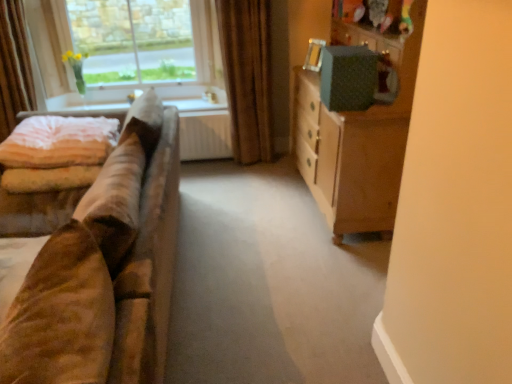
Question: Can you confirm if light pink velvety quilt at left is bigger than clear glass window at upper left?

Choices:
 (A) no
 (B) yes

Answer: (A)

Question: Considering the relative sizes of light pink velvety quilt at left and clear glass window at upper left in the image provided, is light pink velvety quilt at left smaller than clear glass window at upper left?

Choices:
 (A) no
 (B) yes

Answer: (B)

Question: From the image's perspective, is light pink velvety quilt at left located beneath clear glass window at upper left?

Choices:
 (A) yes
 (B) no

Answer: (A)

Question: Is light pink velvety quilt at left to the left of clear glass window at upper left from the viewer's perspective?

Choices:
 (A) yes
 (B) no

Answer: (A)

Question: Would you say clear glass window at upper left is part of light pink velvety quilt at left's contents?

Choices:
 (A) yes
 (B) no

Answer: (B)

Question: Would you say clear glass window at upper left is to the left or to the right of velvet curtain at left, the second curtain from the right, in the picture?

Choices:
 (A) right
 (B) left

Answer: (A)

Question: From a real-world perspective, is clear glass window at upper left positioned above or below velvet curtain at left, positioned as the first curtain in left-to-right order?

Choices:
 (A) below
 (B) above

Answer: (B)

Question: Relative to velvet curtain at left, the second curtain from the right, is clear glass window at upper left in front or behind?

Choices:
 (A) front
 (B) behind

Answer: (B)

Question: Considering the positions of clear glass window at upper left and velvet curtain at left, the second curtain from the right, in the image, is clear glass window at upper left bigger or smaller than velvet curtain at left, the second curtain from the right,?

Choices:
 (A) small
 (B) big

Answer: (B)

Question: Looking at their shapes, would you say brown velvet curtain at upper center, which ranks as the 1th curtain in right-to-left order, is wider or thinner than velvet curtain at left, the second curtain from the right?

Choices:
 (A) wide
 (B) thin

Answer: (A)

Question: Would you say brown velvet curtain at upper center, which ranks as the 1th curtain in right-to-left order, is to the left or to the right of velvet curtain at left, positioned as the first curtain in left-to-right order, in the picture?

Choices:
 (A) right
 (B) left

Answer: (A)

Question: Based on their sizes in the image, would you say brown velvet curtain at upper center, which ranks as the 1th curtain in right-to-left order, is bigger or smaller than velvet curtain at left, the second curtain from the right?

Choices:
 (A) small
 (B) big

Answer: (B)

Question: From a real-world perspective, is brown velvet curtain at upper center, which ranks as the 1th curtain in right-to-left order, above or below velvet curtain at left, positioned as the first curtain in left-to-right order?

Choices:
 (A) above
 (B) below

Answer: (B)

Question: Considering the positions of velvet curtain at left, the second curtain from the right, and green textured cabinet at right in the image, is velvet curtain at left, the second curtain from the right, bigger or smaller than green textured cabinet at right?

Choices:
 (A) big
 (B) small

Answer: (B)

Question: In the image, is velvet curtain at left, positioned as the first curtain in left-to-right order, on the left side or the right side of green textured cabinet at right?

Choices:
 (A) left
 (B) right

Answer: (A)